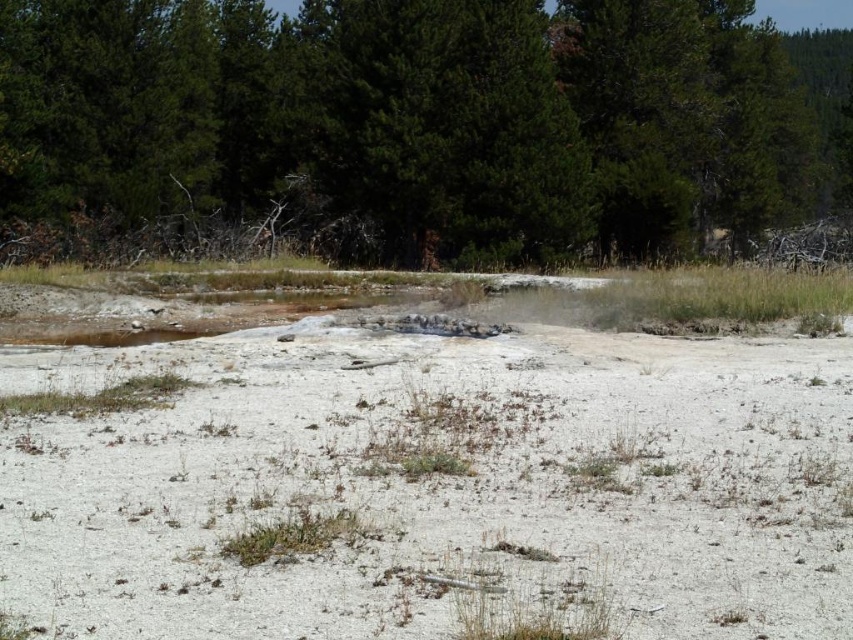
Is white sandy dirt at center below green textured tree at upper center?

Yes.

Find the location of `white sandy dirt at center`. white sandy dirt at center is located at coordinates (437, 484).

Is point (376, 456) closer to camera compared to point (141, 124)?

Yes, it is.

Find the location of a particular element. white sandy dirt at center is located at coordinates (437, 484).